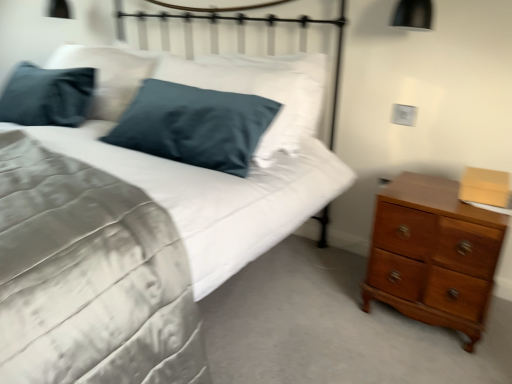
What do you see at coordinates (433, 255) in the screenshot?
I see `shiny brown wooden chest of drawers at right` at bounding box center [433, 255].

What is the approximate width of black matte lampshade at upper right?

10.08 inches.

The image size is (512, 384). Identify the location of metallic white headboard at upper center. point(242,40).

In order to face metallic white headboard at upper center, should I rotate leftwards or rightwards?

You should rotate left by 2.450 degrees.

Find the location of a particular element. shiny brown wooden chest of drawers at right is located at coordinates (433, 255).

Is shiny brown wooden chest of drawers at right bigger than satin blue pillow at upper left?

No.

From the image's perspective, which is above, shiny brown wooden chest of drawers at right or satin blue pillow at upper left?

satin blue pillow at upper left.

Is shiny brown wooden chest of drawers at right positioned with its back to satin blue pillow at upper left?

No, shiny brown wooden chest of drawers at right is not facing the opposite direction of satin blue pillow at upper left.

Identify the location of the chest of drawers behind the satin blue pillow at upper left. This screenshot has width=512, height=384. (433, 255).

Does point (91, 347) come farther from viewer compared to point (257, 26)?

No, it is in front of (257, 26).

How many degrees apart are the facing directions of satin blue pillow at upper left and metallic white headboard at upper center?

The facing directions of satin blue pillow at upper left and metallic white headboard at upper center are 6.18 degrees apart.

You are a GUI agent. You are given a task and a screenshot of the screen. Output one action in this format:
    pyautogui.click(x=<x>, y=<y>)
    Task: Click on the headboard above the satin blue pillow at upper left (from the image's perspective)
    The image size is (512, 384).
    Given the screenshot: What is the action you would take?
    pyautogui.click(x=242, y=40)

Considering the relative positions of satin blue pillow at upper left and metallic white headboard at upper center in the image provided, is satin blue pillow at upper left to the left of metallic white headboard at upper center from the viewer's perspective?

Yes.

Does black matte lampshade at upper right have a lesser height compared to metallic white headboard at upper center?

Yes, black matte lampshade at upper right is shorter than metallic white headboard at upper center.

Is black matte lampshade at upper right spatially inside metallic white headboard at upper center, or outside of it?

The correct answer is: outside.

Does black matte lampshade at upper right have a smaller size compared to metallic white headboard at upper center?

Indeed, black matte lampshade at upper right has a smaller size compared to metallic white headboard at upper center.

Is satin blue pillow at upper left far from black matte lampshade at upper right?

Absolutely, satin blue pillow at upper left is distant from black matte lampshade at upper right.

Considering the sizes of objects satin blue pillow at upper left and black matte lampshade at upper right in the image provided, who is bigger, satin blue pillow at upper left or black matte lampshade at upper right?

satin blue pillow at upper left is bigger.

From a real-world perspective, who is located higher, satin blue pillow at upper left or black matte lampshade at upper right?

black matte lampshade at upper right is physically above.

Consider the image. How distant is satin blue pillow at upper left from black matte lampshade at upper right?

satin blue pillow at upper left is 3.94 feet away from black matte lampshade at upper right.

How much distance is there between black matte lampshade at upper right and shiny brown wooden chest of drawers at right?

black matte lampshade at upper right is 35.01 inches away from shiny brown wooden chest of drawers at right.

Could you tell me if black matte lampshade at upper right is turned towards shiny brown wooden chest of drawers at right?

No, black matte lampshade at upper right does not turn towards shiny brown wooden chest of drawers at right.

Considering the relative positions of black matte lampshade at upper right and shiny brown wooden chest of drawers at right in the image provided, is black matte lampshade at upper right behind shiny brown wooden chest of drawers at right?

Yes, black matte lampshade at upper right is further from the viewer.

From the image's perspective, would you say metallic white headboard at upper center is positioned over satin blue pillow at upper left?

Yes, from the image's perspective, metallic white headboard at upper center is over satin blue pillow at upper left.

Which is closer, (x=114, y=2) or (x=302, y=159)?

The point (x=302, y=159) is closer.

Find the location of `bed lying in front of the metallic white headboard at upper center`. bed lying in front of the metallic white headboard at upper center is located at coordinates (91, 275).

How different are the orientations of metallic white headboard at upper center and satin blue pillow at upper left in degrees?

The angular difference between metallic white headboard at upper center and satin blue pillow at upper left is 6.18 degrees.

Does shiny brown wooden chest of drawers at right appear on the left side of metallic white headboard at upper center?

Incorrect, shiny brown wooden chest of drawers at right is not on the left side of metallic white headboard at upper center.

From the image's perspective, which object appears higher, shiny brown wooden chest of drawers at right or metallic white headboard at upper center?

metallic white headboard at upper center is shown above in the image.

Which point is more distant from viewer, (443, 300) or (316, 37)?

Point (316, 37)

Considering the positions of objects shiny brown wooden chest of drawers at right and metallic white headboard at upper center in the image provided, who is in front, shiny brown wooden chest of drawers at right or metallic white headboard at upper center?

shiny brown wooden chest of drawers at right is closer to the camera.

I want to click on chest of drawers on the right of satin blue pillow at upper left, so click(433, 255).

In order to click on headboard behind the satin blue pillow at upper left in this screenshot , I will do `click(242, 40)`.

Estimate the real-world distances between objects in this image. Which object is further from shiny brown wooden chest of drawers at right, satin blue pillow at upper left or metallic white headboard at upper center?

metallic white headboard at upper center is further to shiny brown wooden chest of drawers at right.

Looking at the image, which one is located further to satin blue pillow at upper left, metallic white headboard at upper center or shiny brown wooden chest of drawers at right?

metallic white headboard at upper center lies further to satin blue pillow at upper left than the other object.

Based on their spatial positions, is metallic white headboard at upper center or black matte lampshade at upper right further from satin blue pillow at upper left?

Among the two, black matte lampshade at upper right is located further to satin blue pillow at upper left.

Which object lies further to the anchor point metallic white headboard at upper center, black matte lampshade at upper right or shiny brown wooden chest of drawers at right?

shiny brown wooden chest of drawers at right.

Looking at the image, which one is located closer to shiny brown wooden chest of drawers at right, satin blue pillow at upper left or black matte lampshade at upper right?

satin blue pillow at upper left.

Estimate the real-world distances between objects in this image. Which object is closer to black matte lampshade at upper right, satin blue pillow at upper left or shiny brown wooden chest of drawers at right?

The object closer to black matte lampshade at upper right is shiny brown wooden chest of drawers at right.

From the image, which object appears to be farther from metallic white headboard at upper center, shiny brown wooden chest of drawers at right or satin blue pillow at upper left?

Based on the image, satin blue pillow at upper left appears to be further to metallic white headboard at upper center.

Which object lies nearer to the anchor point shiny brown wooden chest of drawers at right, black matte lampshade at upper right or satin blue pillow at upper left?

Among the two, satin blue pillow at upper left is located nearer to shiny brown wooden chest of drawers at right.

Find the location of a particular element. headboard between black matte lampshade at upper right and shiny brown wooden chest of drawers at right in the vertical direction is located at coordinates (242, 40).

Locate an element on the screen. headboard located between satin blue pillow at upper left and shiny brown wooden chest of drawers at right in the left-right direction is located at coordinates (242, 40).

The width and height of the screenshot is (512, 384). I want to click on bedside lamp situated between satin blue pillow at upper left and shiny brown wooden chest of drawers at right from left to right, so pyautogui.click(x=413, y=15).

You are a GUI agent. You are given a task and a screenshot of the screen. Output one action in this format:
    pyautogui.click(x=<x>, y=<y>)
    Task: Click on the headboard situated between satin blue pillow at upper left and black matte lampshade at upper right from left to right
    
    Given the screenshot: What is the action you would take?
    pyautogui.click(x=242, y=40)